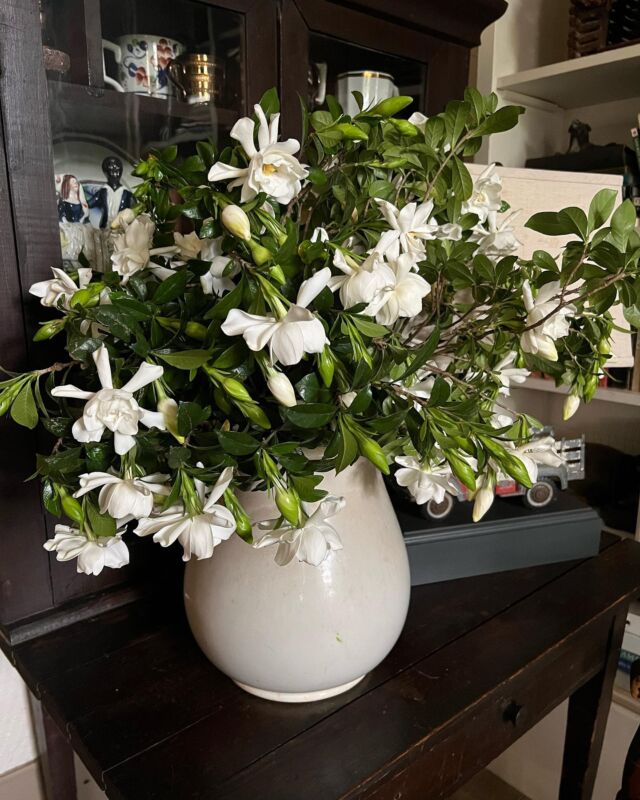
This screenshot has width=640, height=800. I want to click on black figurine, so click(x=114, y=174).